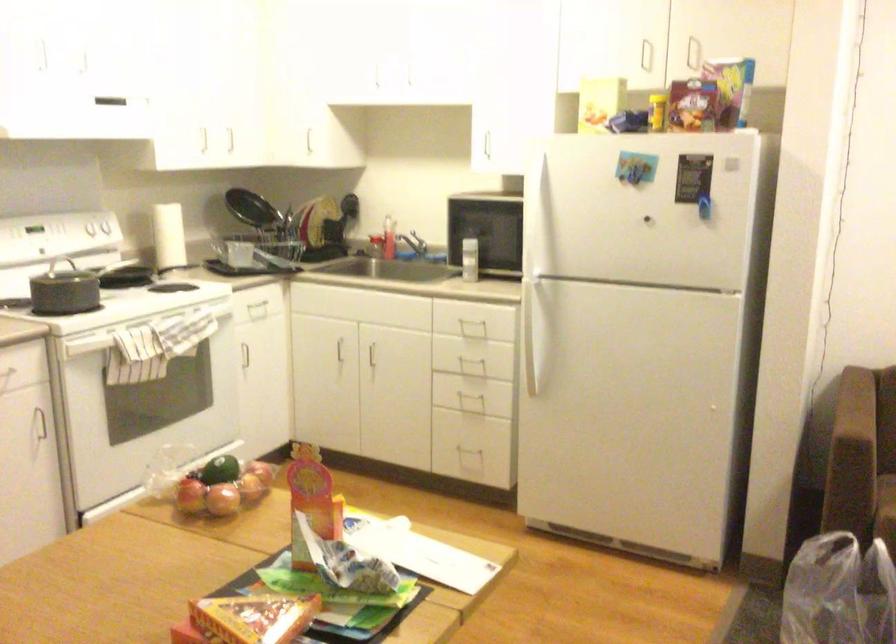
In order to click on white stove knob in this screenshot , I will do pos(98,232).